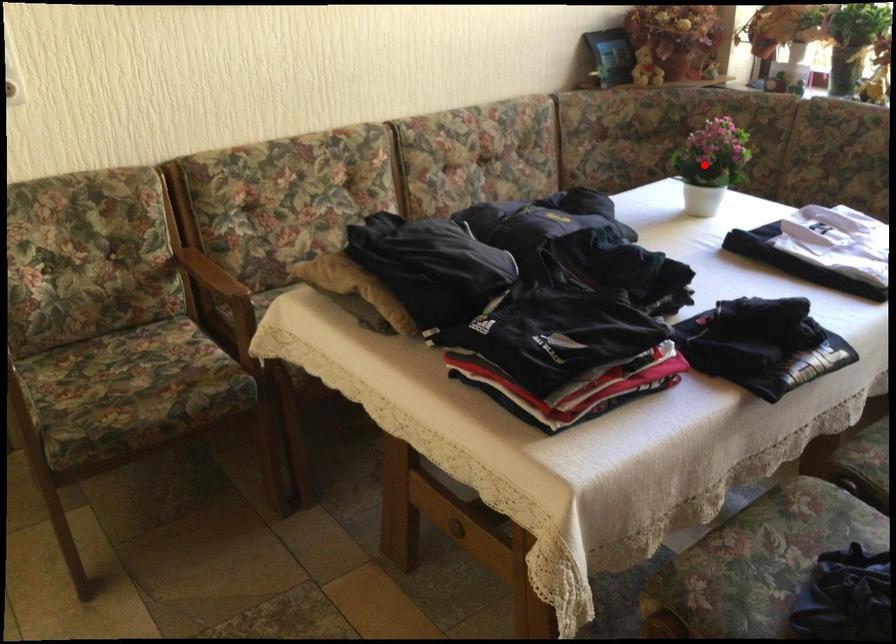
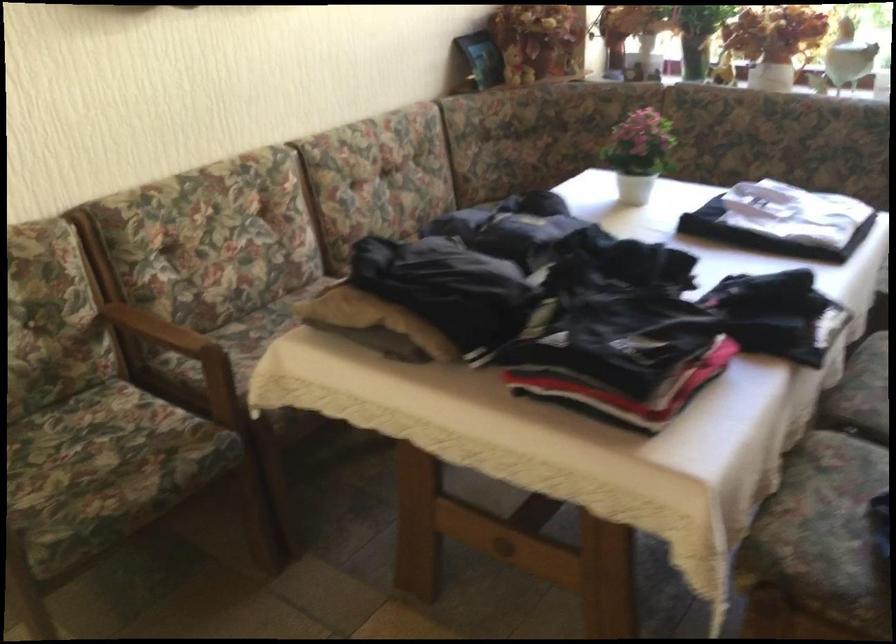
Question: I am providing you with two images of the same scene from different viewpoints. A red point is marked on the first image. At the location where the point appears in image 1, is it still visible in image 2?

Choices:
 (A) Yes
 (B) No

Answer: (A)